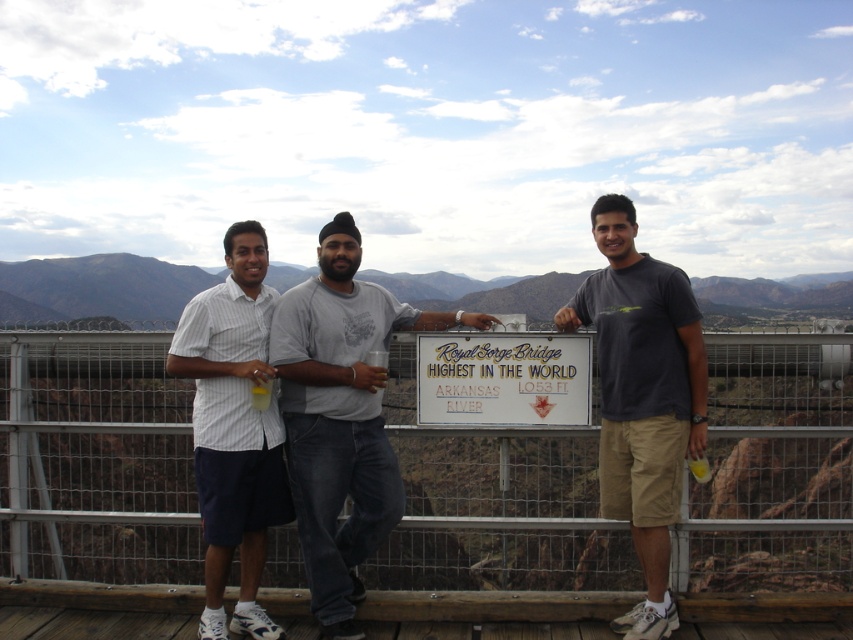
You are a photographer planning to take a photo of the gold metallic sign at center and the brown rocky mountain at center. Based on the scene, which object is closer to the camera?

The brown rocky mountain at center is closer to the camera than the gold metallic sign at center because the gold metallic sign at center is positioned behind the brown rocky mountain at center.

You are standing on the wooden platform at the Royal Gorge Bridge and want to take a photo of two specific points marked as point (422, 307) and point (437, 392). Which point is closer to you when you look through your camera lens?

Point (422, 307) is closer to you than point (437, 392) because it is further to the viewer.